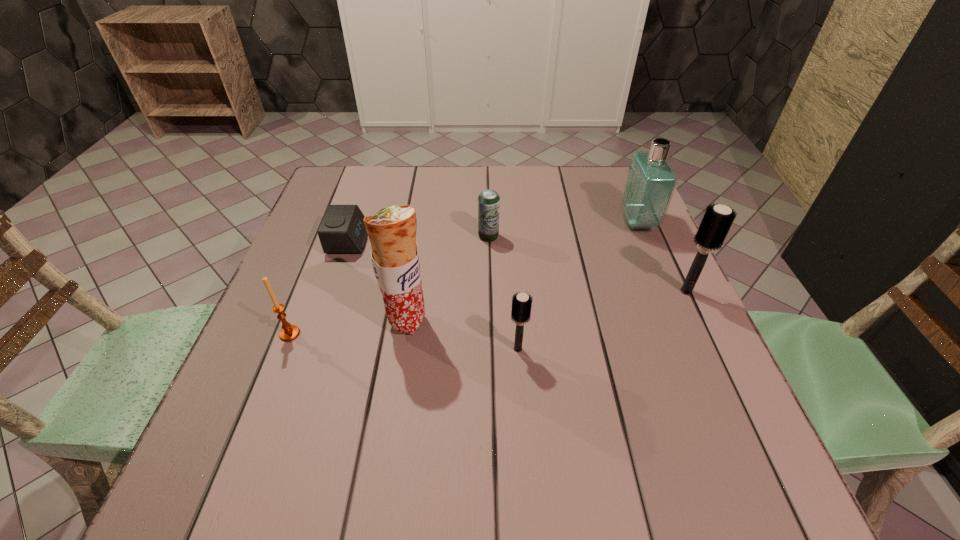
At what (x,y) coordinates should I click in order to perform the action: click on vacant area at the far left corner of the desktop. Please return your answer as a coordinate pair (x, y). The image size is (960, 540). Looking at the image, I should click on click(346, 192).

Where is `vacant point at the far right corner`? This screenshot has height=540, width=960. vacant point at the far right corner is located at coordinates (594, 205).

Locate an element on the screen. The height and width of the screenshot is (540, 960). blank region between the shorter hairbrush and the third object from left to right is located at coordinates (463, 335).

Where is `free spot between the alarm clock and the candle_holder`? This screenshot has width=960, height=540. free spot between the alarm clock and the candle_holder is located at coordinates (320, 287).

The image size is (960, 540). What are the coordinates of `free space between the beer can and the perfume` in the screenshot? It's located at (563, 230).

At what (x,y) coordinates should I click in order to perform the action: click on free spot between the second shortest object and the farther hairbrush. Please return your answer as a coordinate pair (x, y). The image size is (960, 540). Looking at the image, I should click on (588, 264).

Locate an element on the screen. vacant area between the shortest object and the taller hairbrush is located at coordinates (517, 266).

Locate an element on the screen. The width and height of the screenshot is (960, 540). free space between the fifth object from right to left and the candle_holder is located at coordinates tap(348, 328).

I want to click on empty space between the third object from left to right and the fourth object from right to left, so click(x=447, y=279).

Find the location of a particular element. This screenshot has height=540, width=960. free space between the alarm clock and the nearer hairbrush is located at coordinates pos(433,295).